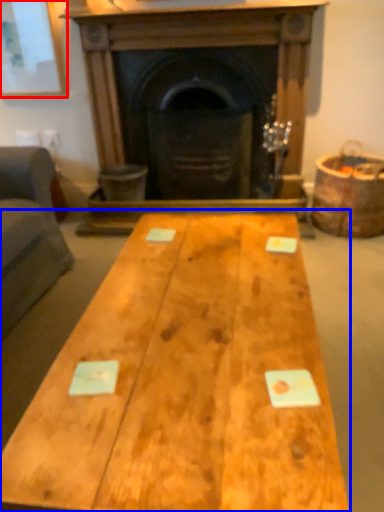
Question: Among these objects, which one is farthest to the camera, picture frame (highlighted by a red box) or table (highlighted by a blue box)?

Choices:
 (A) picture frame
 (B) table

Answer: (A)